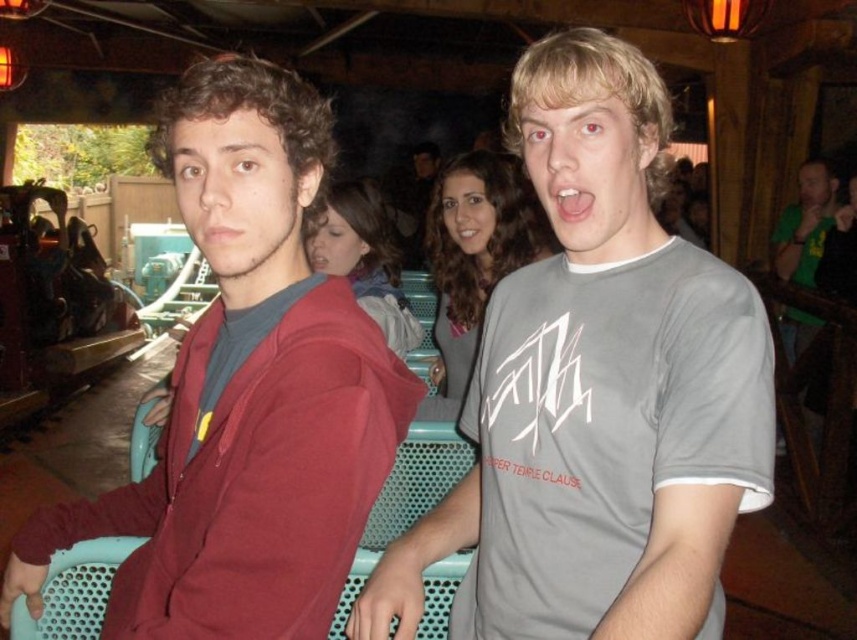
Question: Which point appears farthest from the camera in this image?

Choices:
 (A) (244, 609)
 (B) (796, 314)

Answer: (B)

Question: Can you confirm if gray matte t-shirt at center is smaller than green matte shirt at right?

Choices:
 (A) no
 (B) yes

Answer: (B)

Question: Among these points, which one is nearest to the camera?

Choices:
 (A) (546, 552)
 (B) (225, 232)
 (C) (825, 173)

Answer: (B)

Question: Is gray matte t-shirt at center smaller than matte red hoodie at left?

Choices:
 (A) no
 (B) yes

Answer: (B)

Question: Considering the real-world distances, which object is closest to the green matte shirt at right?

Choices:
 (A) gray matte t-shirt at center
 (B) matte red hoodie at left

Answer: (A)

Question: Can you confirm if gray matte t-shirt at center is smaller than matte red hoodie at left?

Choices:
 (A) no
 (B) yes

Answer: (B)